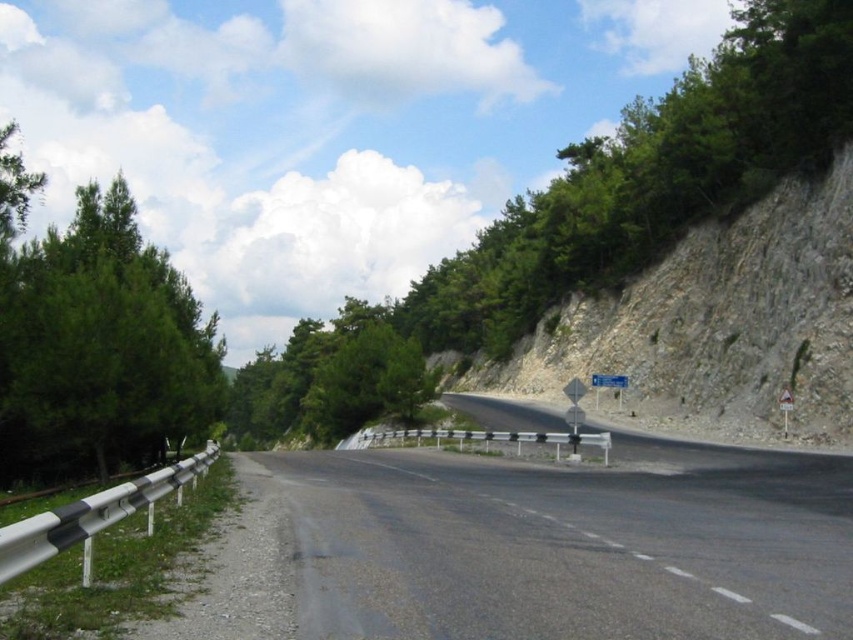
Who is taller, rocky gray hillside at right or blue plastic sign at center?

Standing taller between the two is rocky gray hillside at right.

Is rocky gray hillside at right taller than blue plastic sign at center?

Yes.

Describe the element at coordinates (717, 324) in the screenshot. Image resolution: width=853 pixels, height=640 pixels. I see `rocky gray hillside at right` at that location.

What are the coordinates of `rocky gray hillside at right` in the screenshot? It's located at (717, 324).

Can you confirm if green leafy tree at upper center is bigger than rocky gray hillside at right?

Correct, green leafy tree at upper center is larger in size than rocky gray hillside at right.

Is green leafy tree at upper center shorter than rocky gray hillside at right?

Incorrect, green leafy tree at upper center's height does not fall short of rocky gray hillside at right's.

Identify the location of green leafy tree at upper center. (596, 209).

The image size is (853, 640). I want to click on green leafy tree at upper center, so click(x=596, y=209).

Is green leafy tree at upper center shorter than green needle-like tree at left?

Incorrect, green leafy tree at upper center's height does not fall short of green needle-like tree at left's.

Is green leafy tree at upper center below green needle-like tree at left?

No.

Does point (845, 28) come closer to viewer compared to point (74, 472)?

That is False.

What are the coordinates of `green leafy tree at upper center` in the screenshot? It's located at (596, 209).